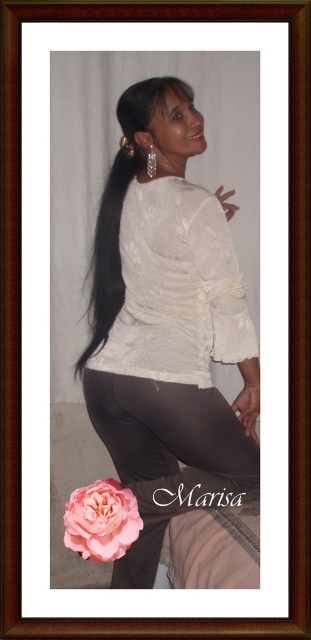
Is white lace blouse at center taller than pink matte rose at lower left?

Indeed, white lace blouse at center has a greater height compared to pink matte rose at lower left.

Can you confirm if white lace blouse at center is wider than pink matte rose at lower left?

Indeed, white lace blouse at center has a greater width compared to pink matte rose at lower left.

Locate an element on the screen. This screenshot has height=640, width=311. white lace blouse at center is located at coordinates (167, 326).

Does black silky hair at center appear on the right side of pink matte rose at lower left?

In fact, black silky hair at center is to the left of pink matte rose at lower left.

Does black silky hair at center have a greater height compared to pink matte rose at lower left?

Indeed, black silky hair at center has a greater height compared to pink matte rose at lower left.

Is point (142, 109) behind point (97, 512)?

Yes, point (142, 109) is farther from viewer.

At what (x,y) coordinates should I click in order to perform the action: click on black silky hair at center. Please return your answer as a coordinate pair (x, y). Looking at the image, I should click on (120, 205).

Measure the distance from matte black leggings at lower center to pink matte rose at lower left.

matte black leggings at lower center is 7.67 inches away from pink matte rose at lower left.

Does matte black leggings at lower center have a larger size compared to pink matte rose at lower left?

Yes, matte black leggings at lower center is bigger than pink matte rose at lower left.

Between point (176, 502) and point (100, 536), which one is positioned behind?

Positioned behind is point (176, 502).

This screenshot has height=640, width=311. What are the coordinates of `matte black leggings at lower center` in the screenshot? It's located at (167, 456).